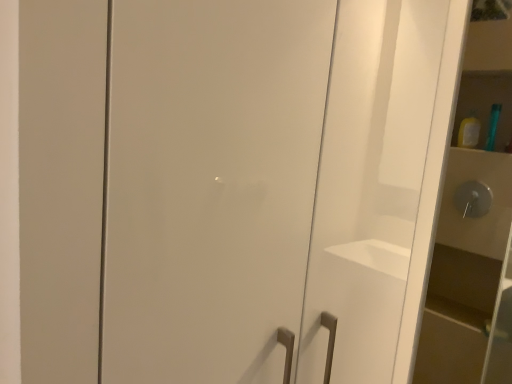
Question: Would you consider glossy white cabinet at center to be distant from green plastic toothbrush at upper right?

Choices:
 (A) yes
 (B) no

Answer: (A)

Question: From a real-world perspective, is glossy white cabinet at center beneath green plastic toothbrush at upper right?

Choices:
 (A) no
 (B) yes

Answer: (B)

Question: Is glossy white cabinet at center smaller than green plastic toothbrush at upper right?

Choices:
 (A) yes
 (B) no

Answer: (B)

Question: Is glossy white cabinet at center closer to camera compared to green plastic toothbrush at upper right?

Choices:
 (A) no
 (B) yes

Answer: (B)

Question: From a real-world perspective, is glossy white cabinet at center on green plastic toothbrush at upper right?

Choices:
 (A) no
 (B) yes

Answer: (A)

Question: From the image's perspective, is glossy white cabinet at center above or below matte white cabinet at right?

Choices:
 (A) below
 (B) above

Answer: (B)

Question: Considering their positions, is glossy white cabinet at center located in front of or behind matte white cabinet at right?

Choices:
 (A) front
 (B) behind

Answer: (A)

Question: Is glossy white cabinet at center inside the boundaries of matte white cabinet at right, or outside?

Choices:
 (A) outside
 (B) inside

Answer: (A)

Question: Looking at the image, does glossy white cabinet at center seem bigger or smaller compared to matte white cabinet at right?

Choices:
 (A) small
 (B) big

Answer: (A)

Question: Do you think green plastic toothbrush at upper right is within matte white cabinet at right, or outside of it?

Choices:
 (A) outside
 (B) inside

Answer: (A)

Question: Relative to matte white cabinet at right, is green plastic toothbrush at upper right in front or behind?

Choices:
 (A) behind
 (B) front

Answer: (A)

Question: From the image's perspective, is green plastic toothbrush at upper right positioned above or below matte white cabinet at right?

Choices:
 (A) below
 (B) above

Answer: (B)

Question: In terms of width, does green plastic toothbrush at upper right look wider or thinner when compared to matte white cabinet at right?

Choices:
 (A) thin
 (B) wide

Answer: (B)

Question: Would you say matte white cabinet at right is to the left or to the right of glossy white cabinet at center in the picture?

Choices:
 (A) right
 (B) left

Answer: (A)

Question: Is matte white cabinet at right inside the boundaries of glossy white cabinet at center, or outside?

Choices:
 (A) inside
 (B) outside

Answer: (B)